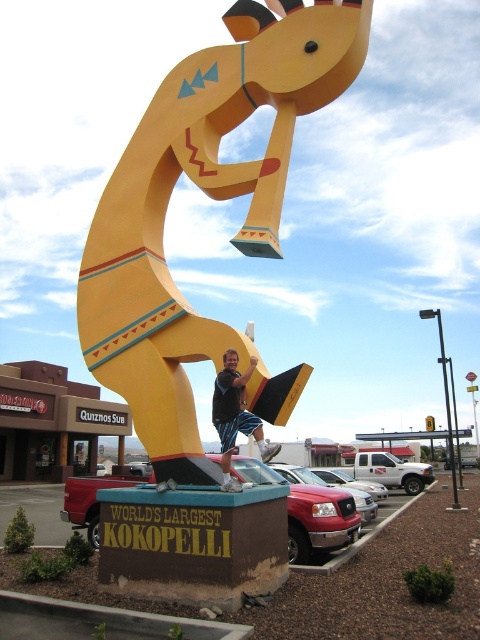
Question: Does metallic red truck at center have a lesser width compared to matte black shorts at center?

Choices:
 (A) yes
 (B) no

Answer: (B)

Question: Is yellow matte kokopelli at center positioned in front of metallic red truck at center?

Choices:
 (A) no
 (B) yes

Answer: (B)

Question: Estimate the real-world distances between objects in this image. Which object is farther from the yellow matte kokopelli at center?

Choices:
 (A) metallic red truck at center
 (B) matte black shorts at center

Answer: (A)

Question: Which of the following is the farthest from the observer?

Choices:
 (A) yellow matte kokopelli at center
 (B) matte black shorts at center

Answer: (A)

Question: Is metallic red truck at center positioned behind matte black shorts at center?

Choices:
 (A) yes
 (B) no

Answer: (A)

Question: Which object is the farthest from the metallic red truck at center?

Choices:
 (A) yellow matte kokopelli at center
 (B) matte black shorts at center

Answer: (B)